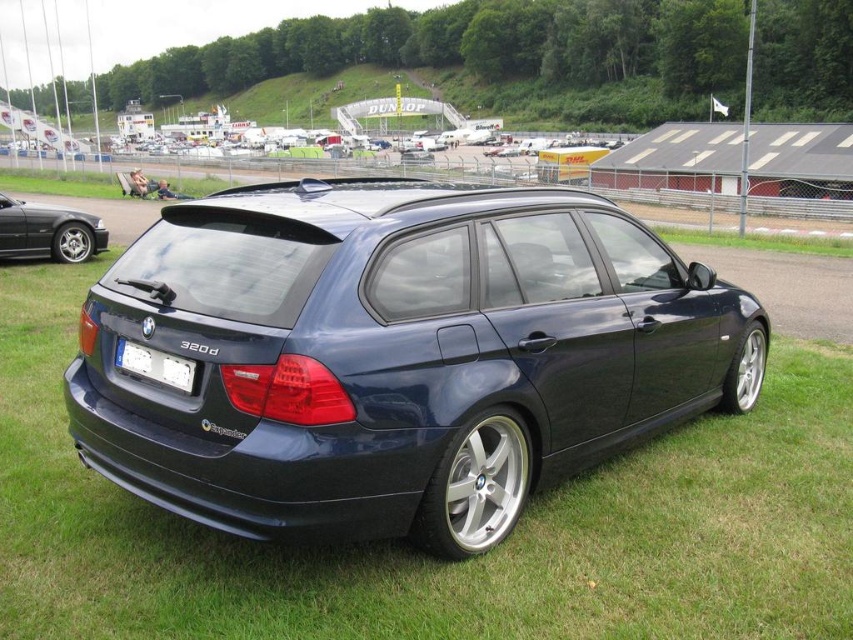
You are a photographer standing at the center of a racetrack. You want to capture a photo of the satin dark blue wagon at center. According to the coordinates provided, in which direction should you move to get the best shot?

Since the satin dark blue wagon at center is located at coordinates point (396, 355), you should move towards the center of the racetrack to align with the car for the best shot.

In the scene shown: You are a photographer positioned at the trackside. You need to capture a photo that includes both the satin dark blue wagon at center and the shiny black car at left. Based on their positions, which car should be placed closer to the bottom of the frame?

The satin dark blue wagon at center is below the shiny black car at left, so to include both in the photo, the satin dark blue wagon at center should be positioned closer to the bottom of the frame.

Based on the photo, you are a photographer standing at the front of the dark blue BMW 320d station wagon. You want to take a photo that includes both the point at position (247, 492) and the point at (126, 364). Which point should you focus on first to ensure both are in sharp focus?

You should focus on point (126, 364) first because it is farther from the camera than point (247, 492). By focusing on the farther point, the closer point will also be within the depth of field, ensuring both are in sharp focus.